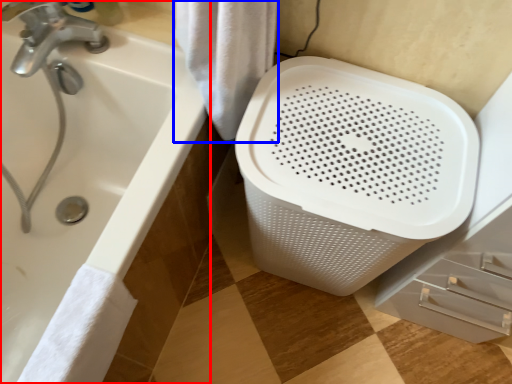
Question: Which object is further to the camera taking this photo, bathtub (highlighted by a red box) or bath towel (highlighted by a blue box)?

Choices:
 (A) bathtub
 (B) bath towel

Answer: (B)